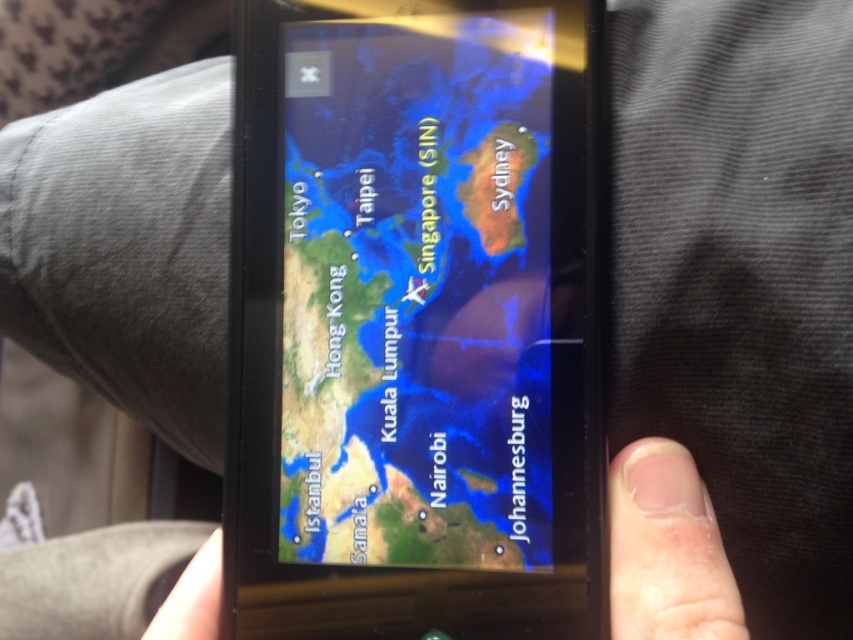
Can you confirm if satellite map at center is positioned above nail polish at lower right?

Yes, satellite map at center is above nail polish at lower right.

Does satellite map at center have a greater width compared to nail polish at lower right?

Incorrect, satellite map at center's width does not surpass nail polish at lower right's.

Between point (392, 147) and point (708, 627), which one is positioned behind?

The point (392, 147) is behind.

This screenshot has width=853, height=640. In order to click on satellite map at center in this screenshot , I will do `click(416, 292)`.